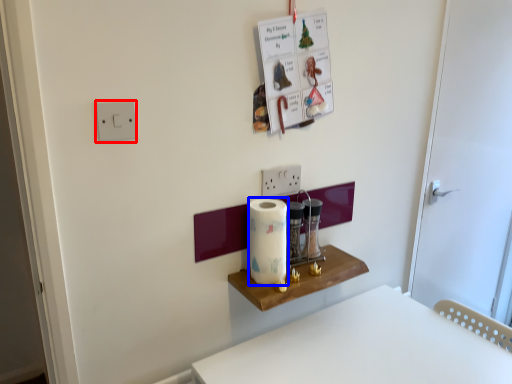
Question: Which object is further to the camera taking this photo, light switch (highlighted by a red box) or paper towel (highlighted by a blue box)?

Choices:
 (A) light switch
 (B) paper towel

Answer: (B)